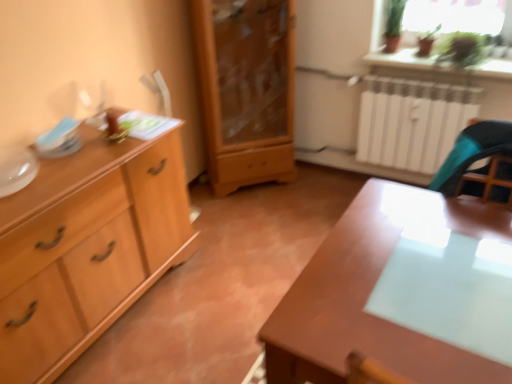
Question: Is glossy wood table at center at the right side of light wood cabinet at left, the 1th chest of drawers positioned from the left?

Choices:
 (A) yes
 (B) no

Answer: (A)

Question: Is glossy wood table at center at the left side of light wood cabinet at left, the 1th chest of drawers positioned from the left?

Choices:
 (A) no
 (B) yes

Answer: (A)

Question: Is light wood cabinet at left, positioned as the 2th chest of drawers in right-to-left order, completely or partially inside glossy wood table at center?

Choices:
 (A) no
 (B) yes

Answer: (A)

Question: Is glossy wood table at center further to camera compared to light wood cabinet at left, the 1th chest of drawers positioned from the left?

Choices:
 (A) yes
 (B) no

Answer: (B)

Question: From the image's perspective, is glossy wood table at center beneath light wood cabinet at left, the 1th chest of drawers positioned from the left?

Choices:
 (A) no
 (B) yes

Answer: (B)

Question: In the image, is light wood cabinet at left, positioned as the 2th chest of drawers in right-to-left order, positioned in front of or behind light wood cabinet at center, arranged as the 1th chest of drawers when viewed from the right?

Choices:
 (A) front
 (B) behind

Answer: (A)

Question: Would you say light wood cabinet at left, the 1th chest of drawers positioned from the left, is to the left or to the right of light wood cabinet at center, the 2th chest of drawers in the left-to-right sequence, in the picture?

Choices:
 (A) right
 (B) left

Answer: (B)

Question: Is point (160, 251) closer or farther from the camera than point (259, 102)?

Choices:
 (A) closer
 (B) farther

Answer: (A)

Question: From the image's perspective, is light wood cabinet at left, positioned as the 2th chest of drawers in right-to-left order, above or below light wood cabinet at center, the 2th chest of drawers in the left-to-right sequence?

Choices:
 (A) below
 (B) above

Answer: (A)

Question: From their relative heights in the image, would you say glossy wood table at center is taller or shorter than transparent glass table at right?

Choices:
 (A) short
 (B) tall

Answer: (B)

Question: From a real-world perspective, relative to transparent glass table at right, is glossy wood table at center vertically above or below?

Choices:
 (A) below
 (B) above

Answer: (A)

Question: Considering the positions of point (346, 331) and point (437, 228), is point (346, 331) closer or farther from the camera than point (437, 228)?

Choices:
 (A) closer
 (B) farther

Answer: (A)

Question: Relative to transparent glass table at right, is glossy wood table at center in front or behind?

Choices:
 (A) front
 (B) behind

Answer: (A)

Question: Is point (284, 43) positioned closer to the camera than point (34, 360)?

Choices:
 (A) closer
 (B) farther

Answer: (B)

Question: Considering the relative positions of light wood cabinet at center, arranged as the 1th chest of drawers when viewed from the right, and light wood cabinet at left, the 1th chest of drawers positioned from the left, in the image provided, is light wood cabinet at center, arranged as the 1th chest of drawers when viewed from the right, to the left or to the right of light wood cabinet at left, the 1th chest of drawers positioned from the left,?

Choices:
 (A) right
 (B) left

Answer: (A)